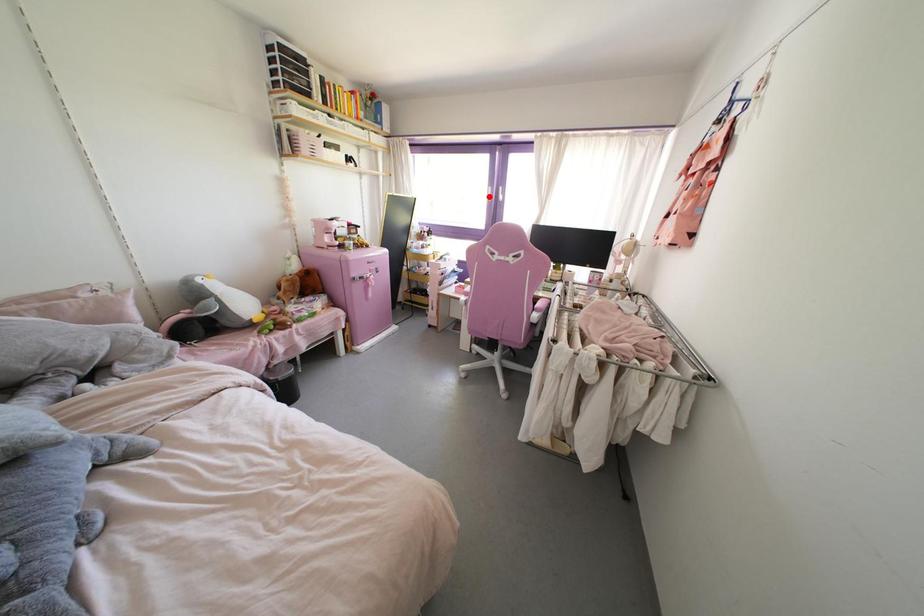
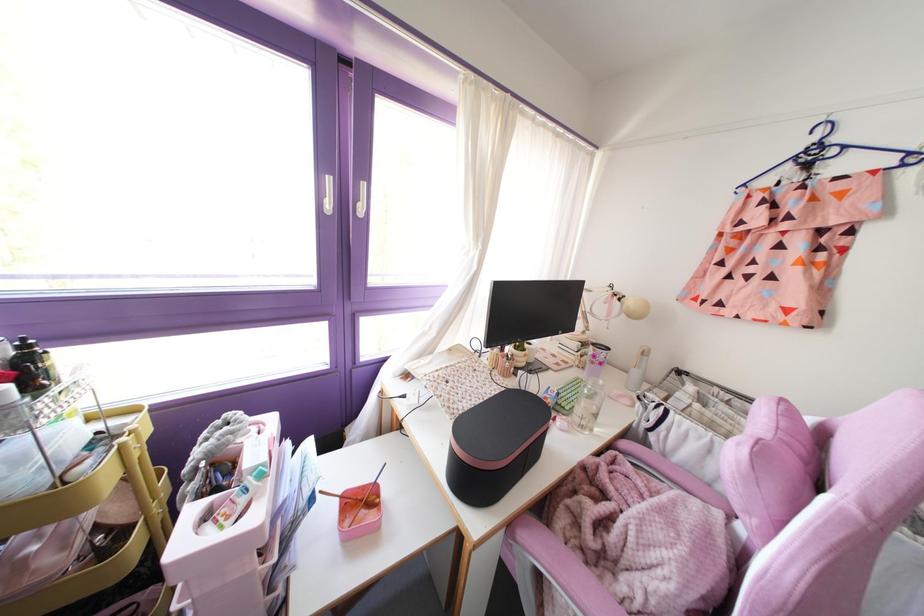
Locate, in the second image, the point that corresponds to the highlighted location in the first image.

(329, 205)